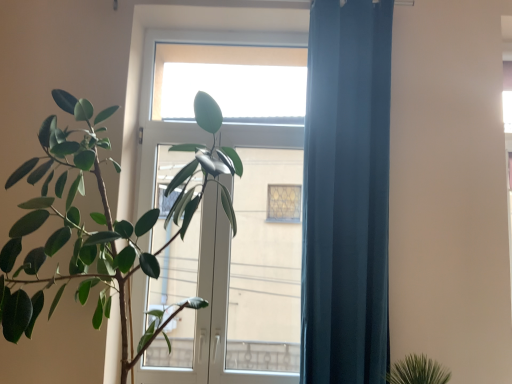
Question: Considering the relative positions of dark blue fabric curtain at right and transparent glass screen door at center in the image provided, is dark blue fabric curtain at right to the left of transparent glass screen door at center from the viewer's perspective?

Choices:
 (A) no
 (B) yes

Answer: (A)

Question: Can you confirm if dark blue fabric curtain at right is wider than transparent glass screen door at center?

Choices:
 (A) no
 (B) yes

Answer: (B)

Question: From the image's perspective, is dark blue fabric curtain at right above transparent glass screen door at center?

Choices:
 (A) yes
 (B) no

Answer: (A)

Question: Is dark blue fabric curtain at right oriented away from transparent glass screen door at center?

Choices:
 (A) no
 (B) yes

Answer: (A)

Question: Does dark blue fabric curtain at right have a lesser width compared to transparent glass screen door at center?

Choices:
 (A) no
 (B) yes

Answer: (A)

Question: Is transparent glass screen door at center inside the boundaries of transparent glass window at upper center, or outside?

Choices:
 (A) inside
 (B) outside

Answer: (B)

Question: Is transparent glass screen door at center in front of or behind transparent glass window at upper center in the image?

Choices:
 (A) behind
 (B) front

Answer: (B)

Question: Looking at the image, does transparent glass screen door at center seem bigger or smaller compared to transparent glass window at upper center?

Choices:
 (A) small
 (B) big

Answer: (B)

Question: Is point (260, 172) closer or farther from the camera than point (252, 82)?

Choices:
 (A) farther
 (B) closer

Answer: (A)

Question: In the image, is transparent glass screen door at center positioned in front of or behind dark blue fabric curtain at right?

Choices:
 (A) behind
 (B) front

Answer: (A)

Question: Is point (202, 291) closer or farther from the camera than point (355, 66)?

Choices:
 (A) closer
 (B) farther

Answer: (B)

Question: From a real-world perspective, is transparent glass screen door at center above or below dark blue fabric curtain at right?

Choices:
 (A) above
 (B) below

Answer: (B)

Question: In the image, is transparent glass screen door at center on the left side or the right side of dark blue fabric curtain at right?

Choices:
 (A) left
 (B) right

Answer: (A)

Question: Is dark blue fabric curtain at right inside the boundaries of transparent glass window at upper center, or outside?

Choices:
 (A) outside
 (B) inside

Answer: (A)

Question: Considering the positions of dark blue fabric curtain at right and transparent glass window at upper center in the image, is dark blue fabric curtain at right bigger or smaller than transparent glass window at upper center?

Choices:
 (A) small
 (B) big

Answer: (B)